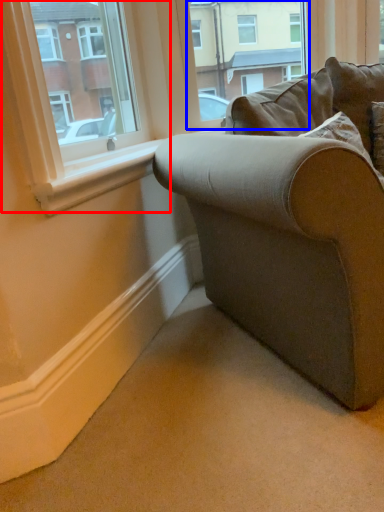
Question: Which object is further to the camera taking this photo, window (highlighted by a red box) or window frame (highlighted by a blue box)?

Choices:
 (A) window
 (B) window frame

Answer: (B)